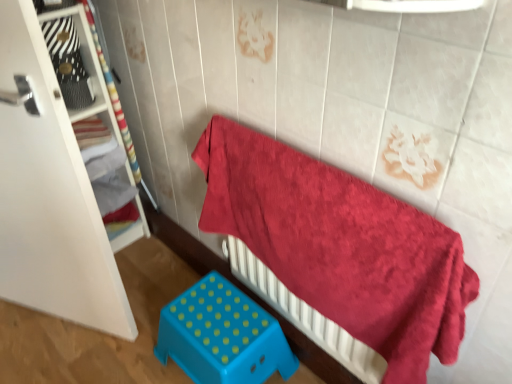
You are a GUI agent. You are given a task and a screenshot of the screen. Output one action in this format:
    pyautogui.click(x=<x>, y=<y>)
    Task: Click on the blank space above blue plastic stool at lower center (from a real-world perspective)
    
    Given the screenshot: What is the action you would take?
    pyautogui.click(x=215, y=320)